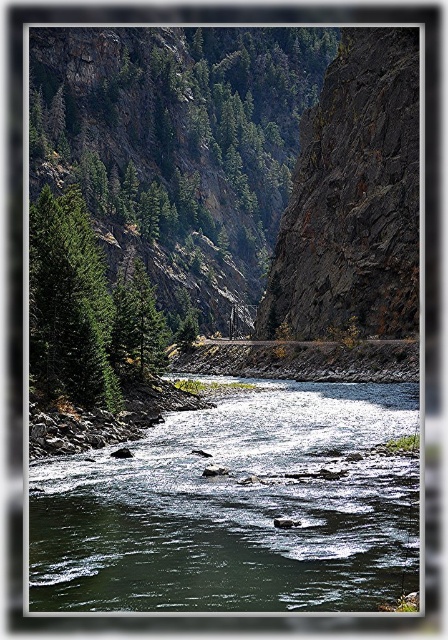
You are standing at the edge of the river and see a point marked at coordinates (236, 508). According to the image, where is this point located?

The point is on the green smooth water at center.